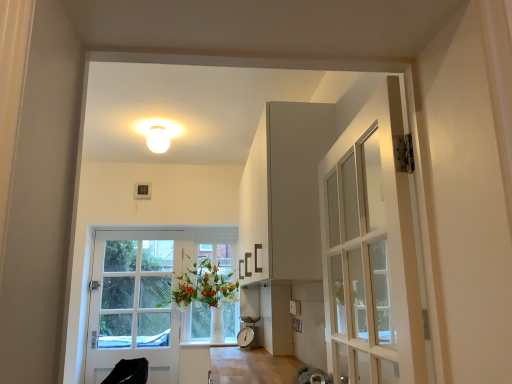
You are a GUI agent. You are given a task and a screenshot of the screen. Output one action in this format:
    pyautogui.click(x=<x>, y=<y>)
    Task: Click on the white glossy door at left
    
    Given the screenshot: What is the action you would take?
    pyautogui.click(x=148, y=296)

What is the approximate width of white glossy door at left?

white glossy door at left is 4.41 inches wide.

Measure the distance between point (226, 248) and camera.

The depth of point (226, 248) is 13.25 feet.

The height and width of the screenshot is (384, 512). I want to click on white glossy door at left, so click(x=148, y=296).

Measure the distance between white glass vase at center and white glossy vase at center.

The distance of white glass vase at center from white glossy vase at center is 7.99 inches.

Could you tell me if white glass vase at center is facing white glossy vase at center?

Yes, white glass vase at center faces towards white glossy vase at center.

What's the angular difference between white glass vase at center and white glossy vase at center's facing directions?

They differ by 0.000221 degrees in their facing directions.

Does white glass vase at center have a lesser height compared to white glossy vase at center?

No, white glass vase at center is not shorter than white glossy vase at center.

Which point is more forward, (158,126) or (231,306)?

The point (158,126) is closer.

Is white matte light fixture at upper center facing towards white glass vase at center?

No, white matte light fixture at upper center is not turned towards white glass vase at center.

From a real-world perspective, which object rests below the other?

white glass vase at center.

What are the coordinates of `lighting located on the left of white glass vase at center` in the screenshot? It's located at (158, 139).

Which of these two, white glossy door at left or white glass vase at center, is bigger?

Bigger between the two is white glossy door at left.

Which of these two, white glossy door at left or white glass vase at center, is wider?

white glossy door at left is wider.

Is white glossy door at left directly adjacent to white glass vase at center?

No, white glossy door at left is not making contact with white glass vase at center.

Is white glossy door at left looking in the opposite direction of white glass vase at center?

No.

Is white matte light fixture at upper center surrounded by white glass vase at center?

No, white matte light fixture at upper center is not surrounded by white glass vase at center.

From a real-world perspective, is white glass vase at center over white matte light fixture at upper center?

No, from a real-world perspective, white glass vase at center is not over white matte light fixture at upper center

How different are the orientations of white glass vase at center and white matte light fixture at upper center in degrees?

There is a 0.504-degree angle between the facing directions of white glass vase at center and white matte light fixture at upper center.

Measure the distance from white glass vase at center to white matte light fixture at upper center.

white glass vase at center and white matte light fixture at upper center are 1.64 meters apart.

Is white glossy door at left situated inside white matte light fixture at upper center or outside?

white glossy door at left exists outside the volume of white matte light fixture at upper center.

From the image's perspective, is white glossy door at left positioned above or below white matte light fixture at upper center?

Clearly, from the image's perspective, white glossy door at left is below white matte light fixture at upper center.

In terms of height, does white glossy door at left look taller or shorter compared to white matte light fixture at upper center?

In the image, white glossy door at left appears to be taller than white matte light fixture at upper center.

Is white glossy door at left bigger or smaller than white matte light fixture at upper center?

white glossy door at left is bigger than white matte light fixture at upper center.

Is white glossy vase at center positioned before white glass vase at center?

Yes, the depth of white glossy vase at center is less than that of white glass vase at center.

Measure the distance from white glossy vase at center to white glass vase at center.

A distance of 7.99 inches exists between white glossy vase at center and white glass vase at center.

Are white glossy vase at center and white glass vase at center making contact?

There is a gap between white glossy vase at center and white glass vase at center.

Considering the relative sizes of white glossy vase at center and white glass vase at center in the image provided, is white glossy vase at center smaller than white glass vase at center?

No, white glossy vase at center is not smaller than white glass vase at center.

Is white glossy door at left at the back of white glossy vase at center?

No.

Looking at this image, measure the distance from white glossy vase at center to white glossy door at left.

white glossy vase at center is 10.95 inches away from white glossy door at left.

From a real-world perspective, is white glossy vase at center located beneath white glossy door at left?

No, from a real-world perspective, white glossy vase at center is not below white glossy door at left.

From the image's perspective, is white glossy vase at center located above or below white glossy door at left?

Clearly, from the image's perspective, white glossy vase at center is above white glossy door at left.

Find the location of a particular element. window frame that appears above the white glossy vase at center (from the image's perspective) is located at coordinates (217, 255).

Image resolution: width=512 pixels, height=384 pixels. I want to click on window frame that is on the right side of white matte light fixture at upper center, so click(x=217, y=255).

From the image, which object appears to be nearer to white matte light fixture at upper center, white glass vase at center or white glossy door at left?

white glossy door at left.

When comparing their distances from white glass vase at center, does white glossy door at left or white glossy vase at center seem closer?

Based on the image, white glossy vase at center appears to be nearer to white glass vase at center.

Estimate the real-world distances between objects in this image. Which object is closer to white matte light fixture at upper center, white glass vase at center or white glossy vase at center?

The object closer to white matte light fixture at upper center is white glossy vase at center.

Which object lies nearer to the anchor point white glossy door at left, white glossy vase at center or white matte light fixture at upper center?

white glossy vase at center.

Based on their spatial positions, is white matte light fixture at upper center or white glossy vase at center further from white glass vase at center?

Among the two, white matte light fixture at upper center is located further to white glass vase at center.

From the image, which object appears to be farther from white glossy vase at center, white glossy door at left or white matte light fixture at upper center?

white matte light fixture at upper center.

Which object lies nearer to the anchor point white glossy door at left, white glossy vase at center or white glass vase at center?

white glossy vase at center is closer to white glossy door at left.

Based on their spatial positions, is white glass vase at center or white matte light fixture at upper center further from white glossy door at left?

Based on the image, white matte light fixture at upper center appears to be further to white glossy door at left.

Locate an element on the screen. Image resolution: width=512 pixels, height=384 pixels. window frame that lies between white matte light fixture at upper center and white glossy vase at center from top to bottom is located at coordinates (217, 255).

The width and height of the screenshot is (512, 384). Find the location of `floral arrangement between white matte light fixture at upper center and white glossy door at left vertically`. floral arrangement between white matte light fixture at upper center and white glossy door at left vertically is located at coordinates click(x=203, y=287).

In order to click on window frame between white matte light fixture at upper center and white glossy door at left from top to bottom in this screenshot , I will do `click(217, 255)`.

Where is `floral arrangement between white glossy door at left and white glass vase at center from left to right`? Image resolution: width=512 pixels, height=384 pixels. floral arrangement between white glossy door at left and white glass vase at center from left to right is located at coordinates (203, 287).